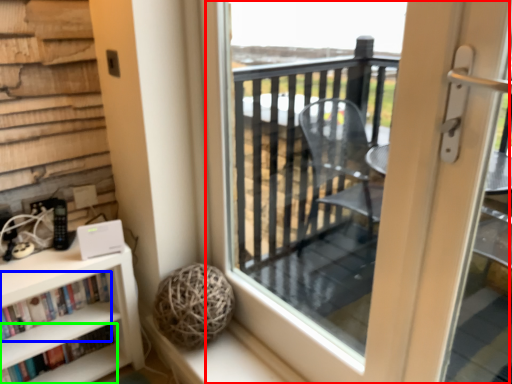
Question: Which is farther away from screen door (highlighted by a red box)? book (highlighted by a blue box) or book (highlighted by a green box)?

Choices:
 (A) book
 (B) book

Answer: (B)